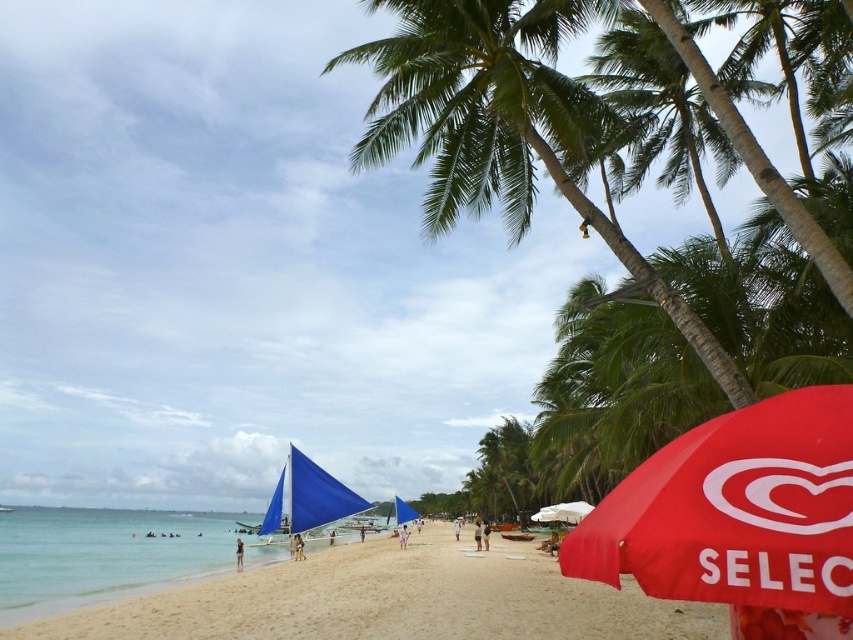
Question: Among these objects, which one is farthest from the camera?

Choices:
 (A) red fabric umbrella at lower right
 (B) beige sandy beach at lower center

Answer: (B)

Question: Is beige sandy beach at lower center to the left of red fabric umbrella at lower right from the viewer's perspective?

Choices:
 (A) yes
 (B) no

Answer: (A)

Question: Which point appears closest to the camera in this image?

Choices:
 (A) (625, 531)
 (B) (270, 627)

Answer: (A)

Question: Does beige sandy beach at lower center appear over red fabric umbrella at lower right?

Choices:
 (A) yes
 (B) no

Answer: (B)

Question: Does beige sandy beach at lower center appear under red fabric umbrella at lower right?

Choices:
 (A) yes
 (B) no

Answer: (A)

Question: Among these points, which one is nearest to the camera?

Choices:
 (A) (325, 620)
 (B) (778, 508)

Answer: (B)